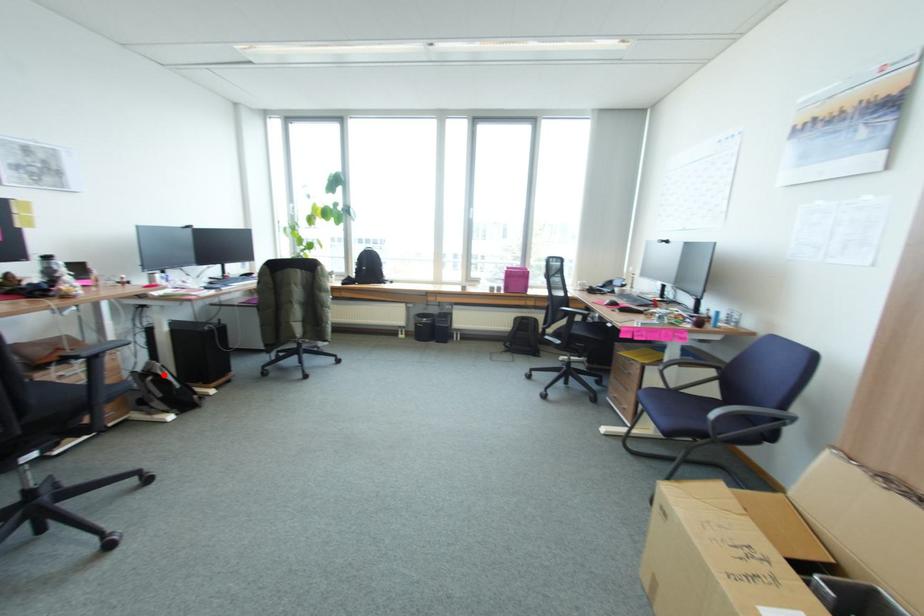
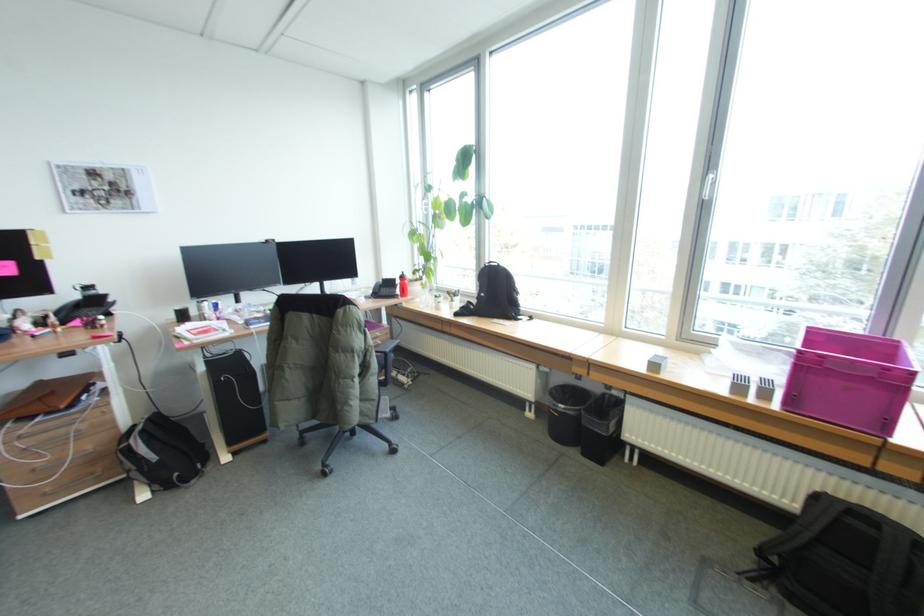
Question: I am providing you with two images of the same scene from different viewpoints. Given a red point in image1, look at the same physical point in image2. Is it:

Choices:
 (A) Closer to the viewpoint
 (B) Farther from the viewpoint

Answer: (A)